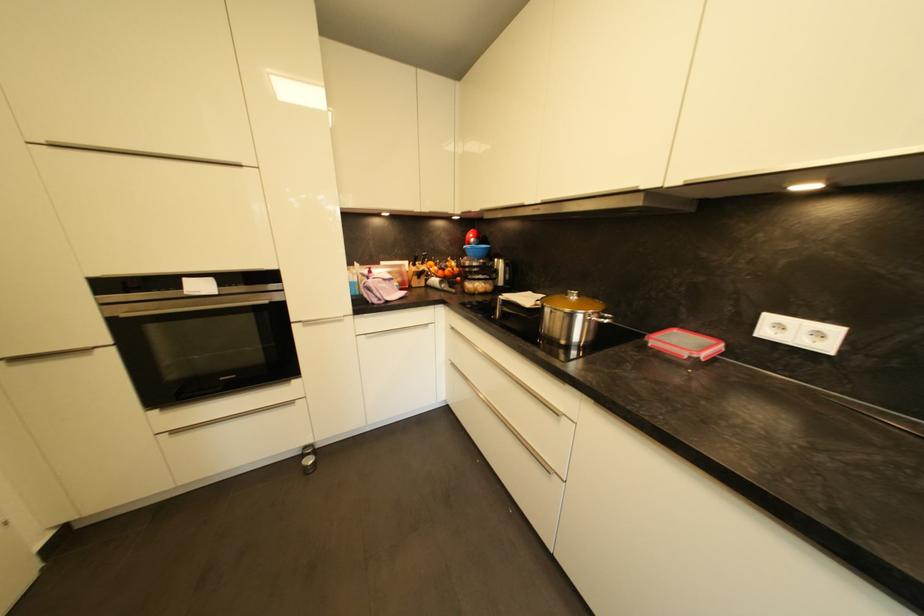
This screenshot has height=616, width=924. What do you see at coordinates (575, 294) in the screenshot?
I see `the pot lid handle` at bounding box center [575, 294].